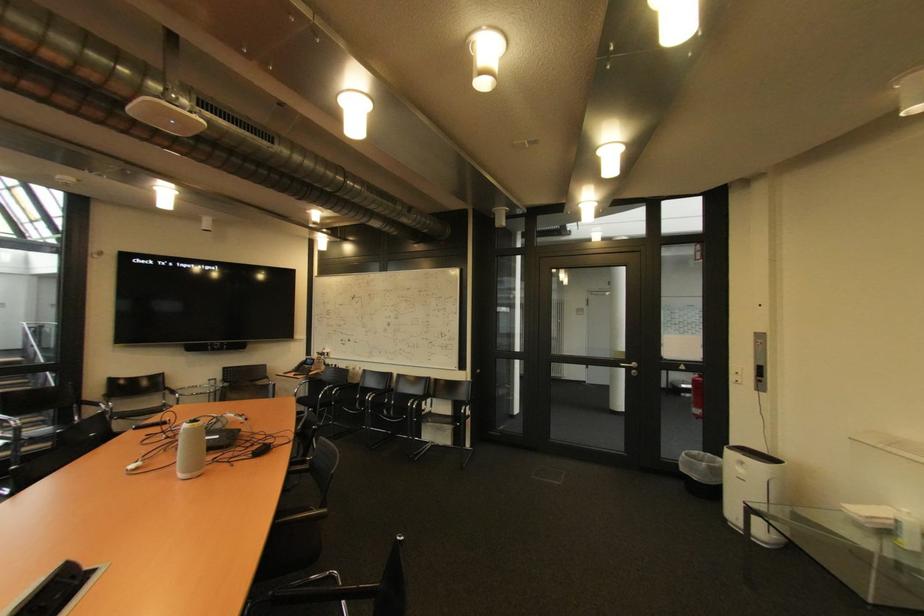
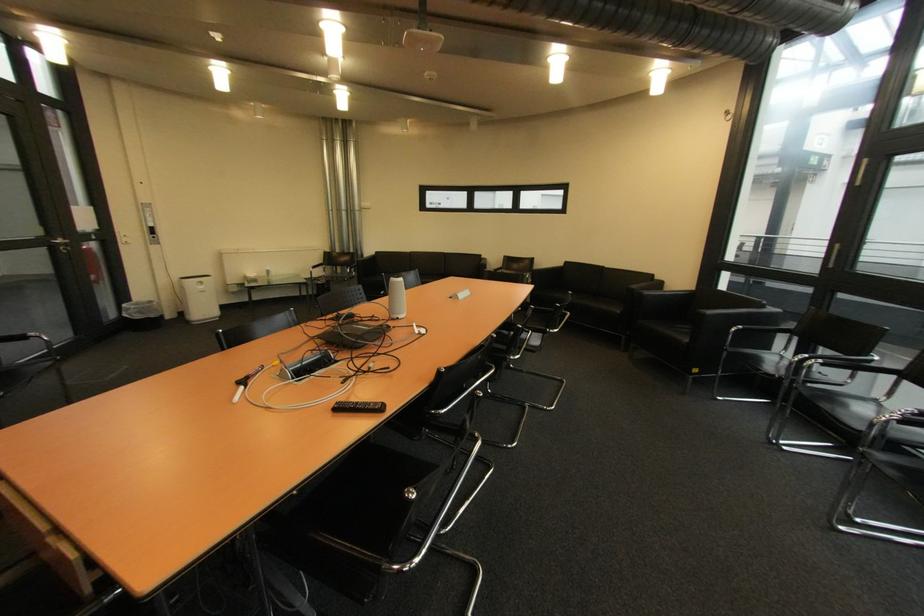
In the second image, find the point that corresponds to [642,365] in the first image.

(68, 241)